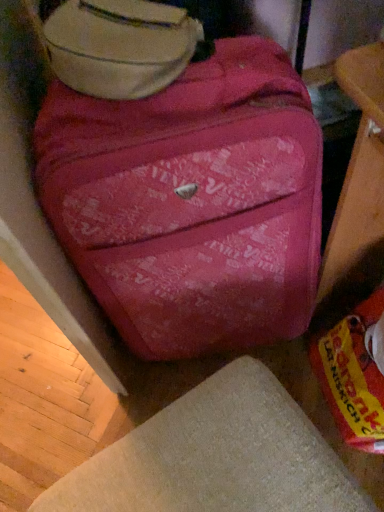
Question: Does matte pink suitcase at center come in front of matte pink suitcase at upper center?

Choices:
 (A) yes
 (B) no

Answer: (A)

Question: Does matte pink suitcase at center appear on the right side of matte pink suitcase at upper center?

Choices:
 (A) no
 (B) yes

Answer: (B)

Question: From the image's perspective, is matte pink suitcase at center below matte pink suitcase at upper center?

Choices:
 (A) yes
 (B) no

Answer: (A)

Question: Is matte pink suitcase at center smaller than matte pink suitcase at upper center?

Choices:
 (A) yes
 (B) no

Answer: (B)

Question: Is matte pink suitcase at center beside matte pink suitcase at upper center?

Choices:
 (A) yes
 (B) no

Answer: (B)

Question: Considering the positions of point (160, 474) and point (170, 11), is point (160, 474) closer or farther from the camera than point (170, 11)?

Choices:
 (A) closer
 (B) farther

Answer: (A)

Question: Considering the positions of beige fabric ottoman at lower center and matte pink suitcase at upper center in the image, is beige fabric ottoman at lower center bigger or smaller than matte pink suitcase at upper center?

Choices:
 (A) big
 (B) small

Answer: (A)

Question: Is beige fabric ottoman at lower center situated inside matte pink suitcase at upper center or outside?

Choices:
 (A) inside
 (B) outside

Answer: (B)

Question: From the image's perspective, is beige fabric ottoman at lower center located above or below matte pink suitcase at upper center?

Choices:
 (A) above
 (B) below

Answer: (B)

Question: Is matte pink suitcase at upper center in front of or behind beige fabric ottoman at lower center in the image?

Choices:
 (A) front
 (B) behind

Answer: (B)

Question: Looking at their shapes, would you say matte pink suitcase at upper center is wider or thinner than beige fabric ottoman at lower center?

Choices:
 (A) wide
 (B) thin

Answer: (B)

Question: Based on their positions, is matte pink suitcase at upper center located to the left or right of beige fabric ottoman at lower center?

Choices:
 (A) left
 (B) right

Answer: (A)

Question: From a real-world perspective, is matte pink suitcase at upper center positioned above or below beige fabric ottoman at lower center?

Choices:
 (A) above
 (B) below

Answer: (A)

Question: From their relative heights in the image, would you say matte pink suitcase at upper center is taller or shorter than matte pink suitcase at center?

Choices:
 (A) short
 (B) tall

Answer: (A)

Question: Considering the positions of point (152, 37) and point (44, 111), is point (152, 37) closer or farther from the camera than point (44, 111)?

Choices:
 (A) closer
 (B) farther

Answer: (A)